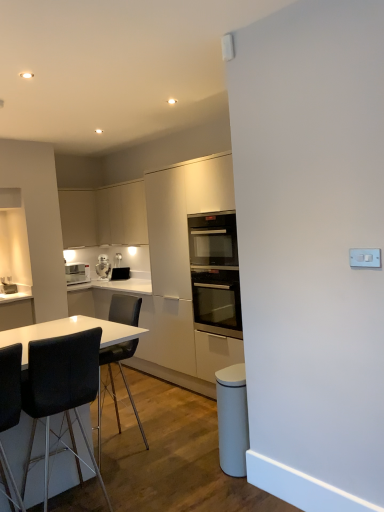
Image resolution: width=384 pixels, height=512 pixels. Identify the location of vacant area located to the right-hand side of black leather chair at lower left, arranged as the second chair when viewed from the back. pyautogui.click(x=153, y=494).